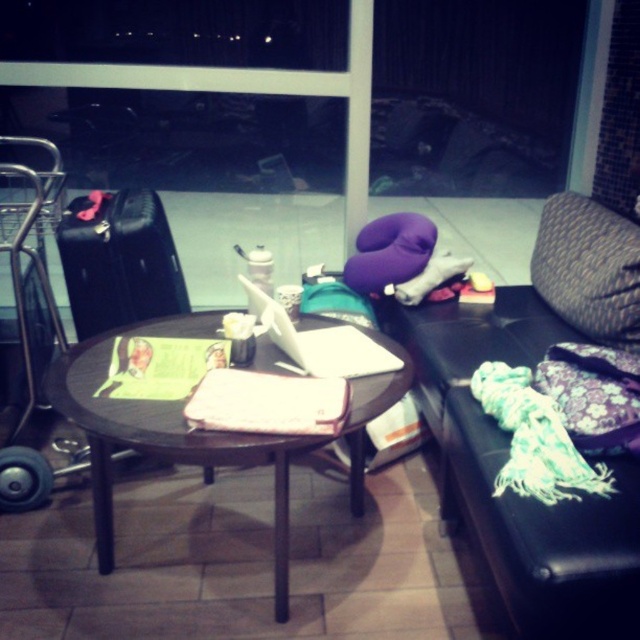
Can you confirm if teal fabric armchair at lower right is shorter than wooden table at center?

In fact, teal fabric armchair at lower right may be taller than wooden table at center.

Describe the element at coordinates (508, 435) in the screenshot. The width and height of the screenshot is (640, 640). I see `teal fabric armchair at lower right` at that location.

Is point (627, 612) positioned before point (173, 451)?

Yes, it is.

At what (x,y) coordinates should I click in order to perform the action: click on teal fabric armchair at lower right. Please return your answer as a coordinate pair (x, y). This screenshot has height=640, width=640. Looking at the image, I should click on (508, 435).

Where is `black leather suitcase at left`? Image resolution: width=640 pixels, height=640 pixels. black leather suitcase at left is located at coordinates point(120,262).

Looking at this image, measure the distance from teal fabric armchair at lower right to black leather suitcase at left.

A distance of 1.15 meters exists between teal fabric armchair at lower right and black leather suitcase at left.

Does point (472, 324) come closer to viewer compared to point (156, 273)?

No.

Locate an element on the screen. The width and height of the screenshot is (640, 640). teal fabric armchair at lower right is located at coordinates (508, 435).

Find the location of a particular element. The image size is (640, 640). teal fabric armchair at lower right is located at coordinates (508, 435).